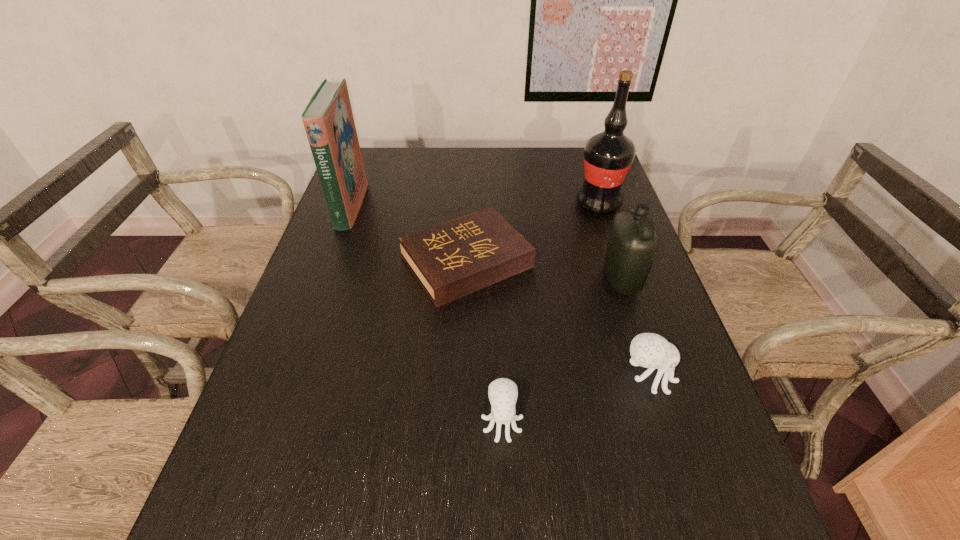
Locate an element on the screen. This screenshot has height=540, width=960. blank space at the far edge of the desktop is located at coordinates (559, 166).

Find the location of `vacant space at the left edge`. vacant space at the left edge is located at coordinates (309, 287).

Where is `free region at the far left corner of the desktop`? The width and height of the screenshot is (960, 540). free region at the far left corner of the desktop is located at coordinates (367, 170).

In the image, there is a desktop. Identify the location of vacant area at the near right corner. (718, 478).

In order to click on free space between the nearer octopus and the wine bottle in this screenshot , I will do `click(550, 313)`.

I want to click on empty space that is in between the second tallest object and the second nearest object, so click(x=499, y=292).

In order to click on free area in between the shortest object and the third tallest object in this screenshot , I will do `click(544, 271)`.

This screenshot has width=960, height=540. I want to click on vacant area between the farther octopus and the shortest object, so click(558, 319).

Find the location of `free space between the bottle and the left octopus`. free space between the bottle and the left octopus is located at coordinates (562, 350).

Identify the location of free spot between the right hardback book and the right octopus. (558, 319).